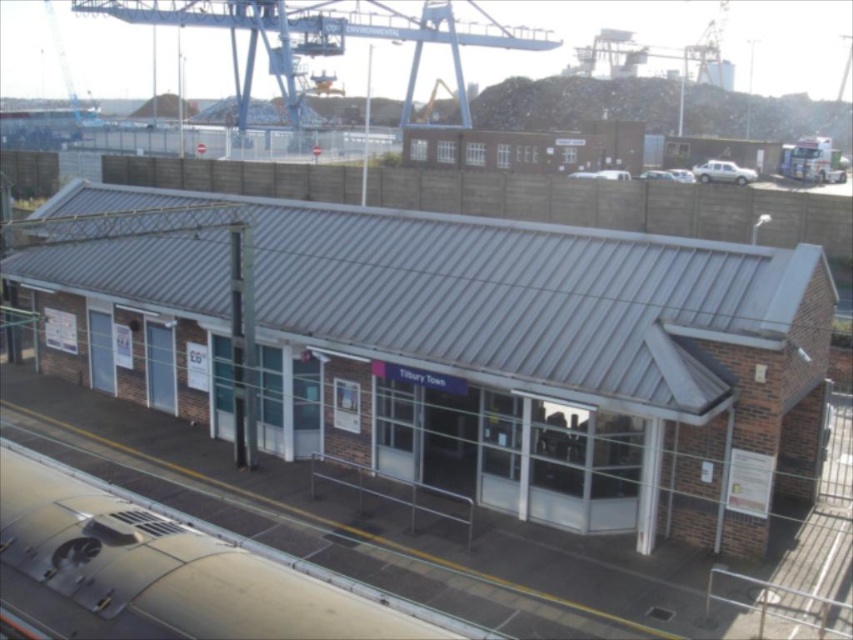
Question: Which is nearer to the metallic silver train at lower center?

Choices:
 (A) metallic brick shed at center
 (B) blue metallic crane at upper center

Answer: (A)

Question: Can you confirm if metallic brick shed at center is positioned above blue metallic crane at upper center?

Choices:
 (A) yes
 (B) no

Answer: (B)

Question: Which point is farther to the camera?

Choices:
 (A) (277, 211)
 (B) (219, 634)
 (C) (299, 38)

Answer: (C)

Question: Is metallic silver train at lower center thinner than blue metallic crane at upper center?

Choices:
 (A) no
 (B) yes

Answer: (B)

Question: Which point appears closest to the camera in this image?

Choices:
 (A) (724, 326)
 (B) (444, 6)

Answer: (A)

Question: Is metallic brick shed at center thinner than blue metallic crane at upper center?

Choices:
 (A) no
 (B) yes

Answer: (B)